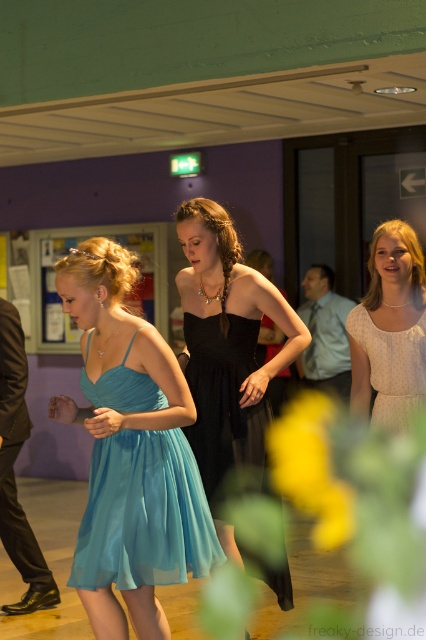
Looking at this image, you are at a social event and see two women in dresses. The first is wearing a light blue chiffon dress at center and the second is wearing a light beige textured dress at center. Which woman is positioned to the right?

The light beige textured dress at center is positioned to the right of the light blue chiffon dress at center.

You are organizing a photo shoot and need to arrange two models wearing the light beige textured dress at right and the light beige textured dress at center. Based on the scene description, which dress might require a wider space for posing?

The light beige textured dress at right might require a wider space for posing since it is wider than the light beige textured dress at center according to the description.

You are standing at the entrance of the hall and see the light blue chiffon dress at center. Can you tell me the location of the point with coordinates (x=143, y=513) on the dress?

The point with coordinates (x=143, y=513) is on the light blue chiffon dress at center.